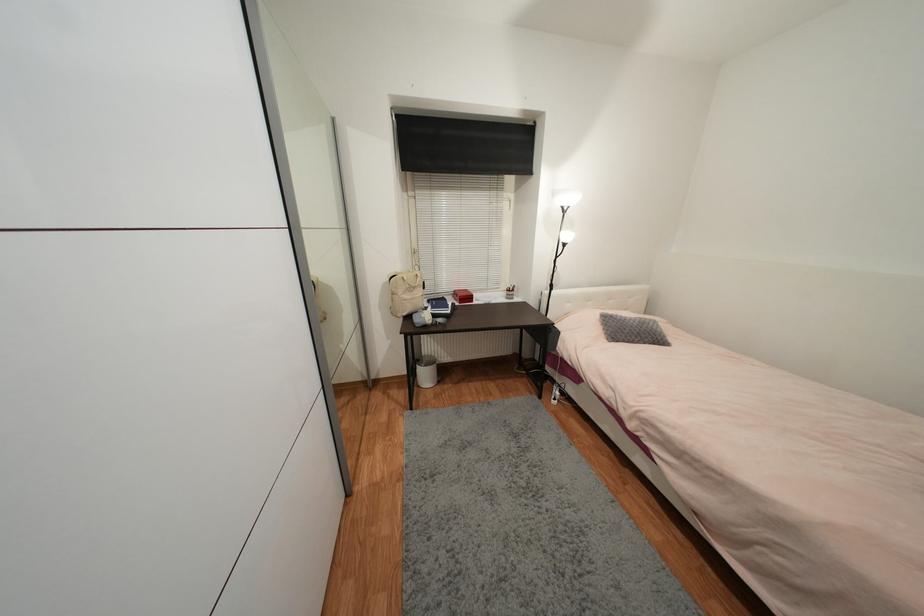
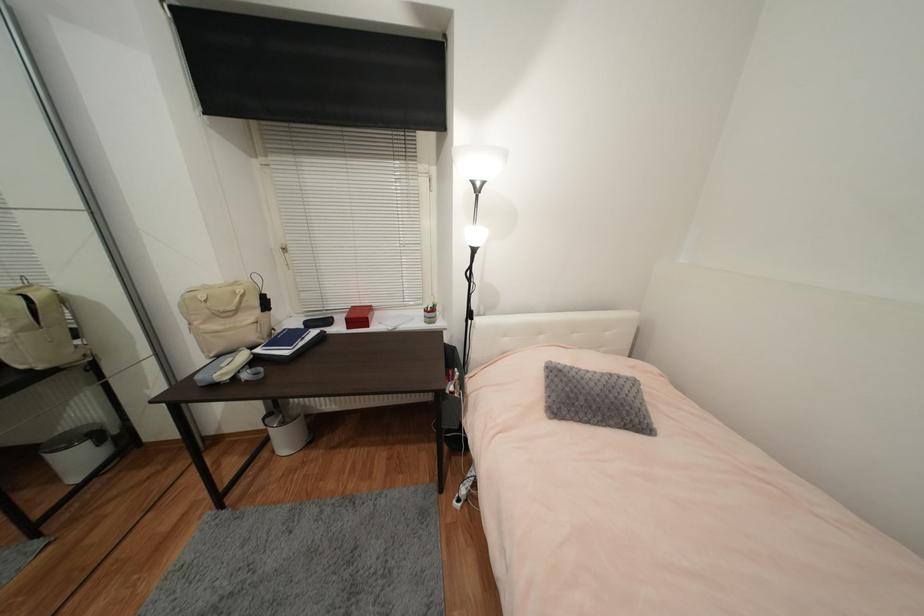
Find the pixel in the second image that matches (x=455, y=309) in the first image.

(306, 344)